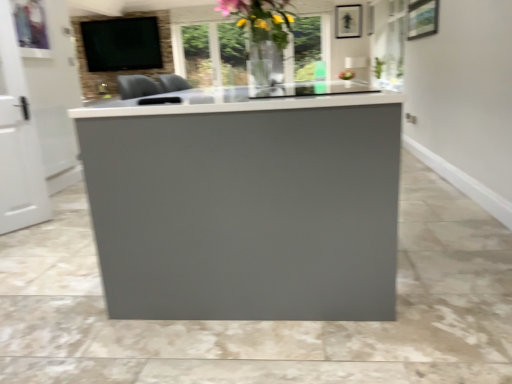
Locate an element on the screen. This screenshot has height=384, width=512. free space below white glossy door at left (from a real-world perspective) is located at coordinates (23, 228).